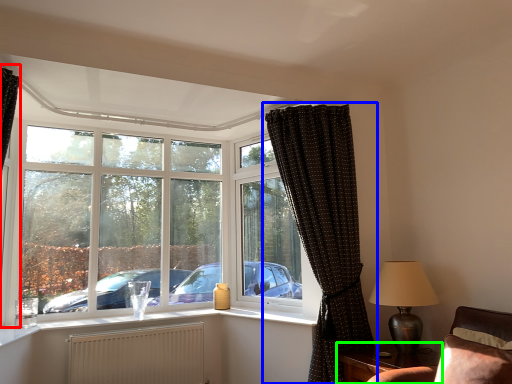
Question: Estimate the real-world distances between objects in this image. Which object is closer to curtain (highlighted by a red box), curtain (highlighted by a blue box) or table (highlighted by a green box)?

Choices:
 (A) curtain
 (B) table

Answer: (A)